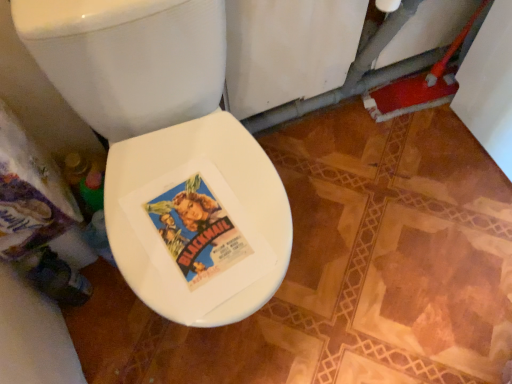
Question: Should I look upward or downward to see white glossy bidet at center?

Choices:
 (A) down
 (B) up

Answer: (A)

Question: Is white glossy toilet seat at center not within white glossy bidet at center?

Choices:
 (A) no
 (B) yes

Answer: (B)

Question: Is white glossy toilet seat at center taller than white glossy bidet at center?

Choices:
 (A) no
 (B) yes

Answer: (B)

Question: From the image's perspective, is white glossy toilet seat at center under white glossy bidet at center?

Choices:
 (A) no
 (B) yes

Answer: (A)

Question: Is white glossy toilet seat at center aimed at white glossy bidet at center?

Choices:
 (A) yes
 (B) no

Answer: (A)

Question: Can you confirm if white glossy toilet seat at center is wider than white glossy bidet at center?

Choices:
 (A) yes
 (B) no

Answer: (A)

Question: Would you say white glossy toilet seat at center contains white glossy bidet at center?

Choices:
 (A) yes
 (B) no

Answer: (A)

Question: From a real-world perspective, is white glossy bidet at center positioned over white glossy toilet seat at center based on gravity?

Choices:
 (A) yes
 (B) no

Answer: (A)

Question: Does white glossy bidet at center have a lesser width compared to white glossy toilet seat at center?

Choices:
 (A) yes
 (B) no

Answer: (A)

Question: Considering the relative positions of white glossy bidet at center and white glossy toilet seat at center in the image provided, is white glossy bidet at center in front of white glossy toilet seat at center?

Choices:
 (A) yes
 (B) no

Answer: (B)

Question: Is white glossy bidet at center turned away from white glossy toilet seat at center?

Choices:
 (A) no
 (B) yes

Answer: (B)

Question: From the image's perspective, is white glossy bidet at center located beneath white glossy toilet seat at center?

Choices:
 (A) no
 (B) yes

Answer: (B)

Question: Is white glossy bidet at center next to white glossy toilet seat at center and touching it?

Choices:
 (A) no
 (B) yes

Answer: (B)

Question: In terms of size, does white glossy toilet seat at center appear bigger or smaller than white glossy bidet at center?

Choices:
 (A) big
 (B) small

Answer: (A)